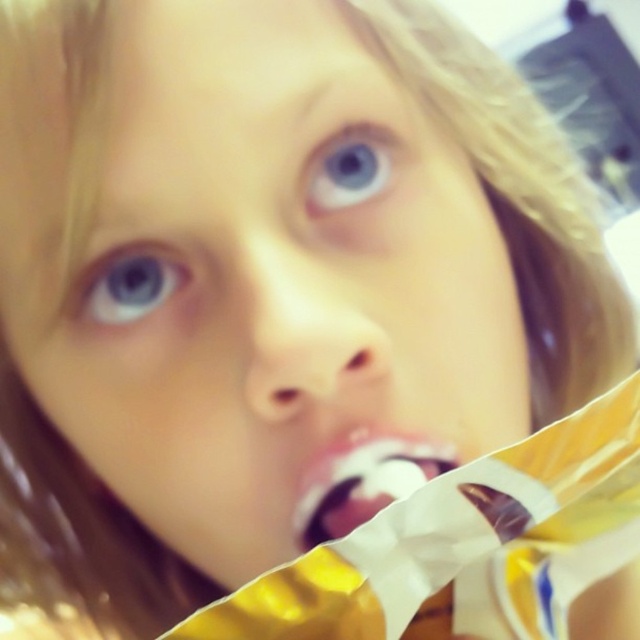
Based on the photo, does blue glossy eye at upper left appear on the right side of blue glossy eye at upper center?

No, blue glossy eye at upper left is not to the right of blue glossy eye at upper center.

Image resolution: width=640 pixels, height=640 pixels. What do you see at coordinates (128, 284) in the screenshot?
I see `blue glossy eye at upper left` at bounding box center [128, 284].

Is point (70, 301) more distant than point (378, 180)?

No, it is in front of (378, 180).

Locate an element on the screen. This screenshot has width=640, height=640. blue glossy eye at upper left is located at coordinates pyautogui.click(x=128, y=284).

Does white glossy pacifier at center have a greater height compared to blue glossy eye at upper left?

Yes.

Between white glossy pacifier at center and blue glossy eye at upper left, which one is positioned lower?

white glossy pacifier at center is below.

Which is in front, point (356, 492) or point (129, 273)?

Point (356, 492) is in front.

At what (x,y) coordinates should I click in order to perform the action: click on white glossy pacifier at center. Please return your answer as a coordinate pair (x, y). Image resolution: width=640 pixels, height=640 pixels. Looking at the image, I should click on pos(362,481).

Based on the photo, who is more forward, [365,465] or [356,128]?

Point [365,465] is more forward.

Who is taller, white glossy pacifier at center or blue glossy eye at upper center?

white glossy pacifier at center

Image resolution: width=640 pixels, height=640 pixels. What do you see at coordinates (362, 481) in the screenshot?
I see `white glossy pacifier at center` at bounding box center [362, 481].

You are a GUI agent. You are given a task and a screenshot of the screen. Output one action in this format:
    pyautogui.click(x=<x>, y=<y>)
    Task: Click on the white glossy pacifier at center
    The height and width of the screenshot is (640, 640).
    Given the screenshot: What is the action you would take?
    pyautogui.click(x=362, y=481)